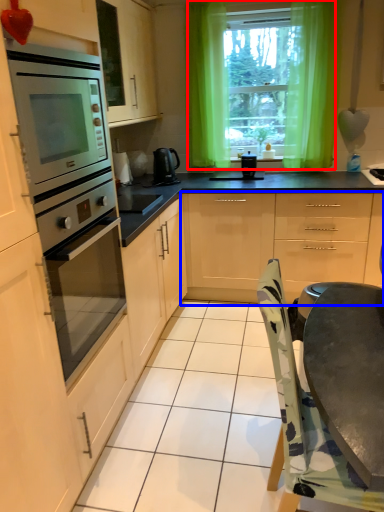
Question: Which object appears farthest to the camera in this image, window (highlighted by a red box) or cabinetry (highlighted by a blue box)?

Choices:
 (A) window
 (B) cabinetry

Answer: (A)